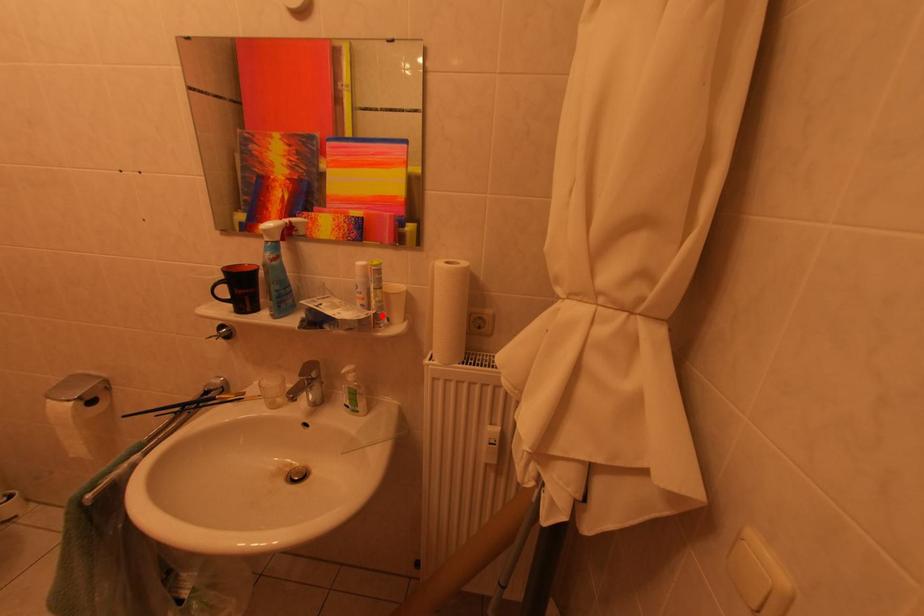
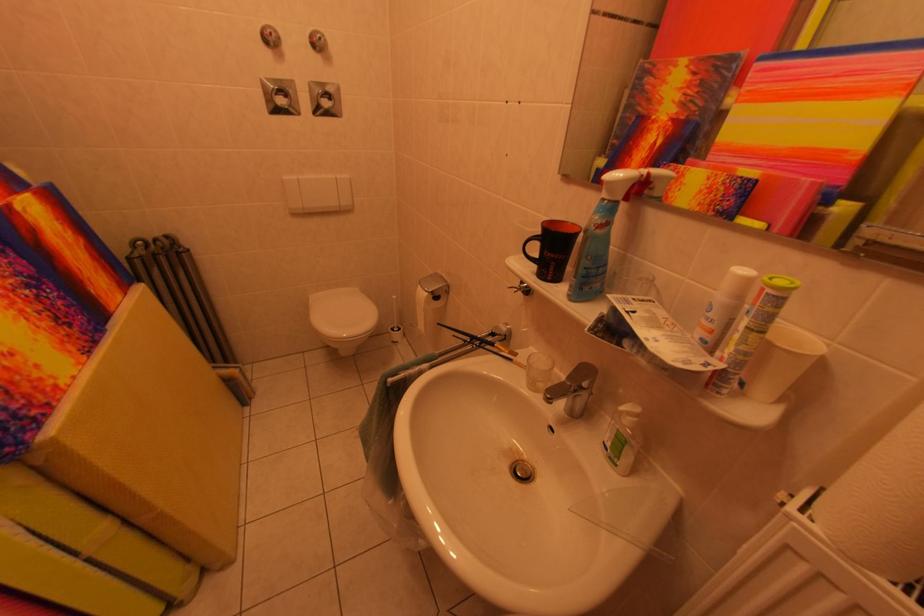
Locate, in the second image, the point that corresponds to the highlighted location in the first image.

(732, 370)